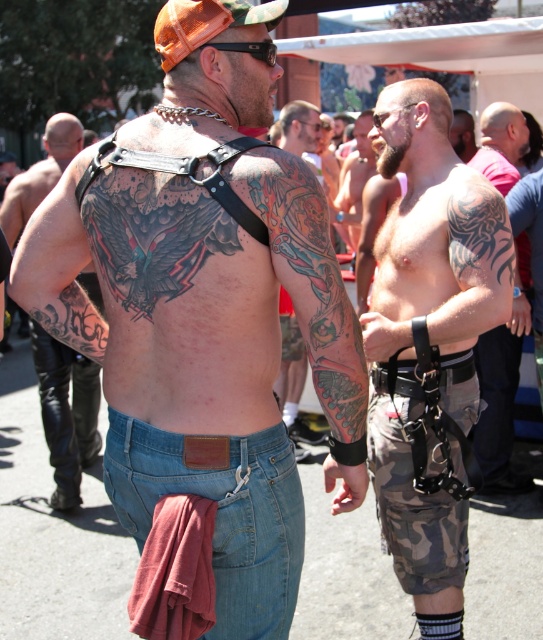
Question: Is black leather belt at upper center above black plastic sunglasses at upper center?

Choices:
 (A) yes
 (B) no

Answer: (B)

Question: Which object appears closest to the camera in this image?

Choices:
 (A) orange mesh baseball cap at upper center
 (B) black ink tattoo at lower left
 (C) camo shorts at right
 (D) shiny black belt at center

Answer: (A)

Question: Which object is the farthest from the denim jeans at lower center?

Choices:
 (A) black plastic sunglasses at upper center
 (B) shiny black belt at center
 (C) colorful tattooed arm at upper center

Answer: (B)

Question: Which object is the closest to the black tattooed arm at upper left?

Choices:
 (A) dark brown leather belt at right
 (B) shiny black belt at center
 (C) colorful tattooed arm at upper center

Answer: (C)

Question: Does denim shorts at center appear on the right side of black plastic sunglasses at upper center?

Choices:
 (A) yes
 (B) no

Answer: (B)

Question: Can you confirm if camo shorts at right is positioned to the left of colorful tattooed arm at center?

Choices:
 (A) yes
 (B) no

Answer: (B)